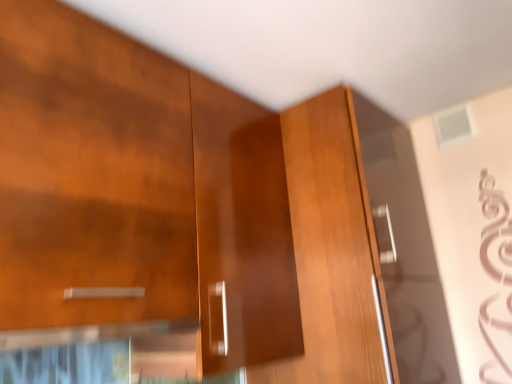
Measure the distance between glossy wood cabinet at upper left and camera.

The depth of glossy wood cabinet at upper left is 31.92 inches.

Find the location of `glossy wood cabinet at upper left`. glossy wood cabinet at upper left is located at coordinates (91, 173).

Describe the element at coordinates (91, 173) in the screenshot. The width and height of the screenshot is (512, 384). I see `glossy wood cabinet at upper left` at that location.

The image size is (512, 384). What are the coordinates of `glossy wood cabinet at upper left` in the screenshot? It's located at (91, 173).